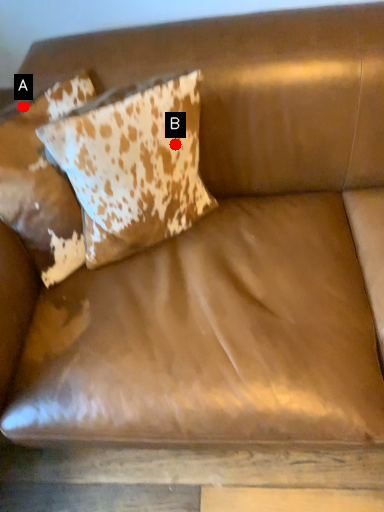
Question: Two points are circled on the image, labeled by A and B beside each circle. Which point is closer to the camera taking this photo?

Choices:
 (A) A is closer
 (B) B is closer

Answer: (B)